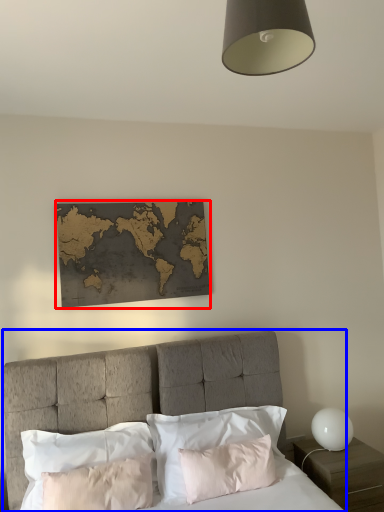
Question: Which object appears farthest to the camera in this image, picture frame (highlighted by a red box) or bed (highlighted by a blue box)?

Choices:
 (A) picture frame
 (B) bed

Answer: (A)